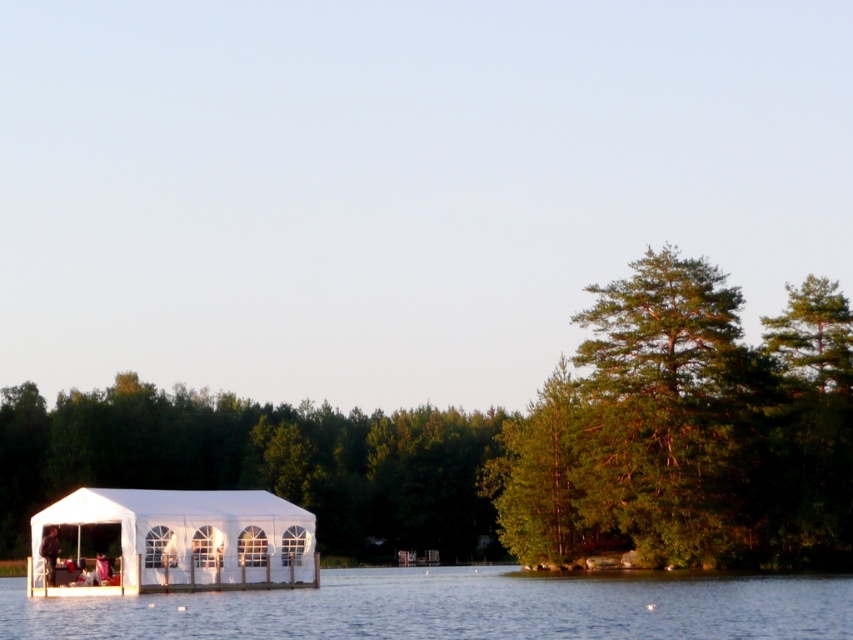
You are planning to set up a picnic area near the white fabric tent at lower center. Considering the presence of the green leafy tree at right, which object would provide more shade for your picnic setup?

The green leafy tree at right has a larger size compared to the white fabric tent at lower center, so it would provide more shade for your picnic setup.

You are a hiker who has just arrived at the lakeside and wants to set up a tent. You see the green leafy tree at right and the white fabric tent at lower left. Which object is located to the right of the other?

The green leafy tree at right is positioned on the right side of white fabric tent at lower left, so the tree is to the right of the tent.

From the picture: You are planning to set up a picnic blanket between the green leafy tree at right and the white fabric tent at lower center. The picnic blanket is 10 feet long. Will there be enough space between them to place the blanket without it overlapping either object?

The distance between the green leafy tree at right and the white fabric tent at lower center is 83.53 feet. Since the picnic blanket is only 10 feet long, there is more than enough space to place it between them without overlapping either object.